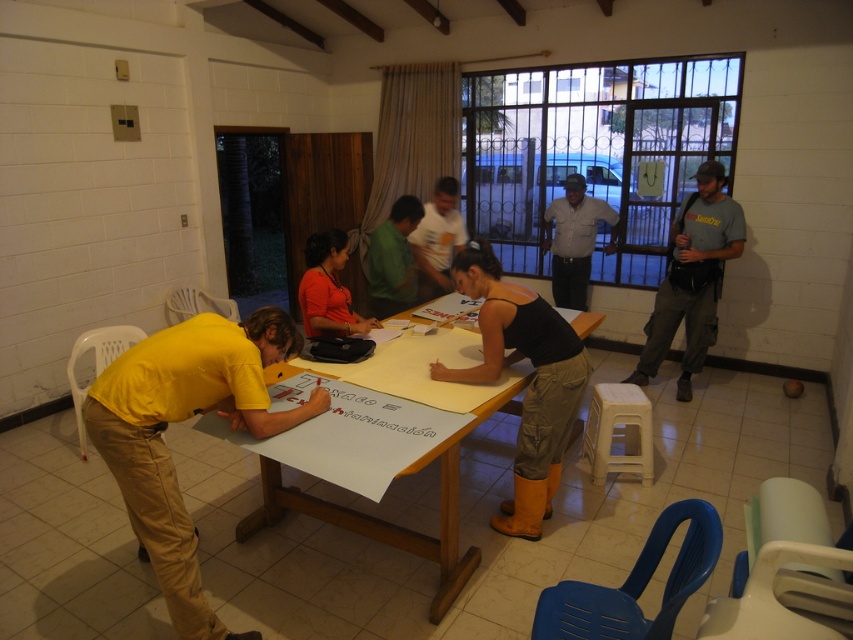
Question: Among these points, which one is farthest from the camera?

Choices:
 (A) (550, 212)
 (B) (335, 369)
 (C) (445, 259)

Answer: (A)

Question: Which object is closer to the camera taking this photo?

Choices:
 (A) yellow matte shirt at left
 (B) green matte shirt at center
 (C) black matte tank top at center
 (D) white cotton shirt at center

Answer: (A)

Question: Is wooden table at center behind green matte shirt at center?

Choices:
 (A) yes
 (B) no

Answer: (B)

Question: Which of the following is the closest to the observer?

Choices:
 (A) green matte shirt at center
 (B) black matte tank top at center
 (C) white cotton shirt at center

Answer: (B)

Question: Where is wooden table at center located in relation to gray shirt at center in the image?

Choices:
 (A) above
 (B) below

Answer: (B)

Question: Does wooden table at center appear under white cotton shirt at center?

Choices:
 (A) no
 (B) yes

Answer: (B)